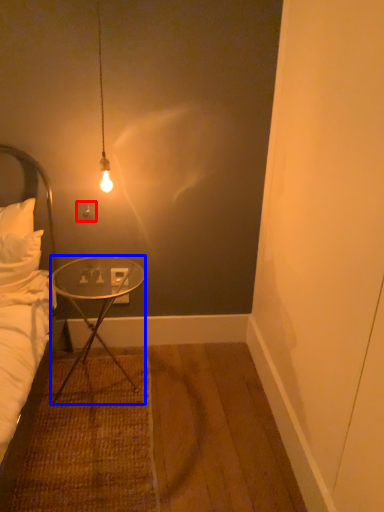
Question: Which object is closer to the camera taking this photo, power outlet (highlighted by a red box) or desk (highlighted by a blue box)?

Choices:
 (A) power outlet
 (B) desk

Answer: (B)